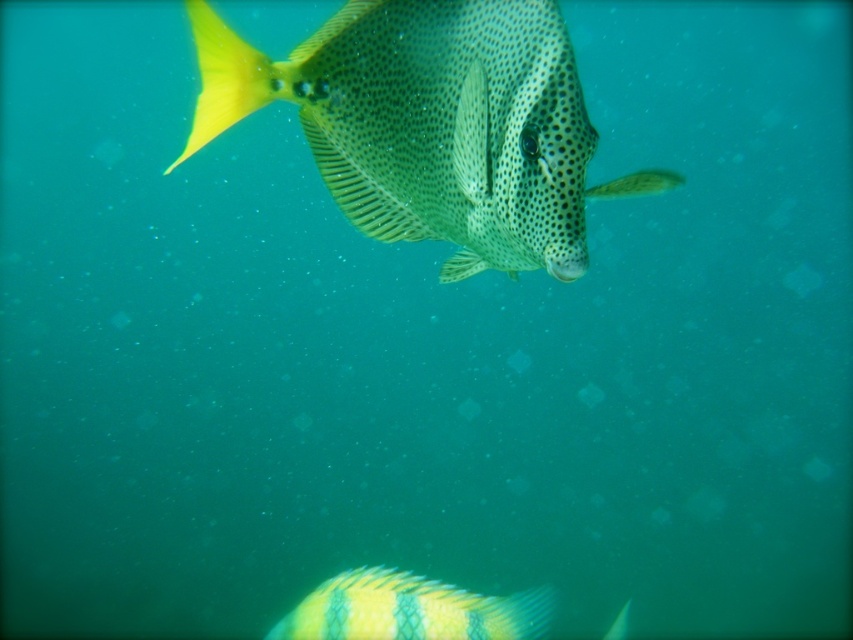
You are a marine biologist observing underwater life. You notice the spotted yellow fish at center and the yellow matte fin at upper left. Which of these two objects is bigger in size?

The spotted yellow fish at center is larger in size compared to the yellow matte fin at upper left.

You are an underwater photographer aiming to capture the spotted yellow fish at center. Your camera has a focus point at coordinates point (431, 124). Will this focus point help you capture the fish?

Yes, the focus point at point (431, 124) is exactly where the spotted yellow fish at center is located, so it will help capture the fish.